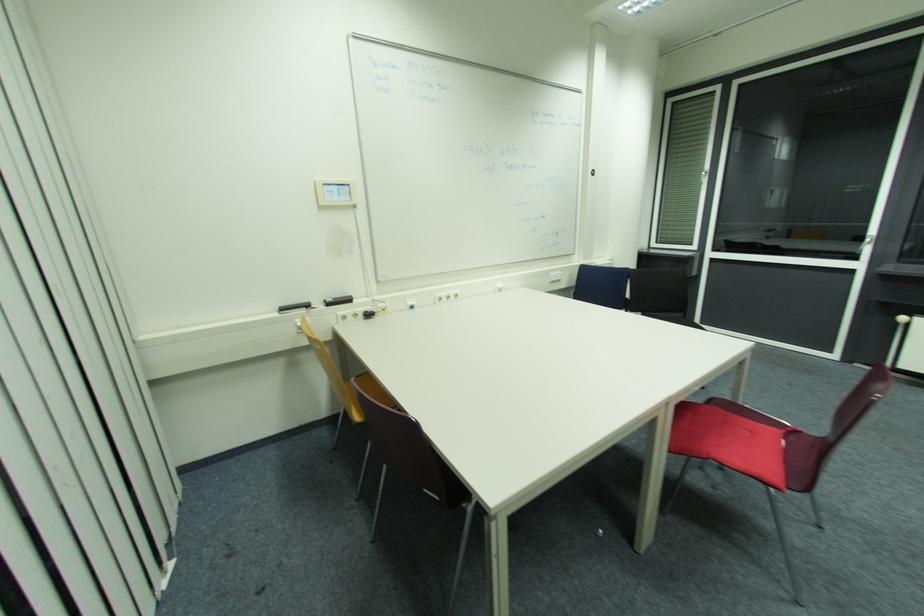
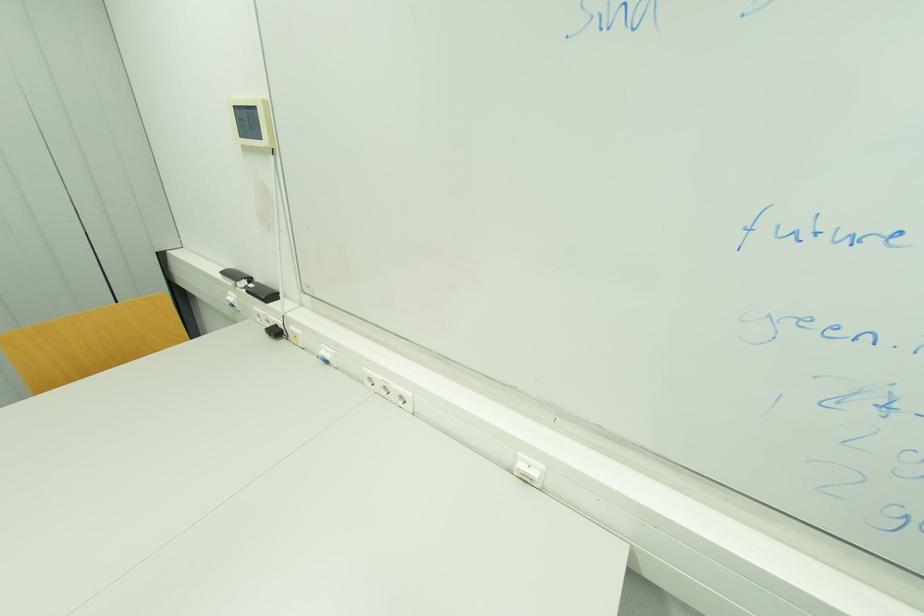
Question: I am providing you with two images of the same scene from different viewpoints. Please identify which objects are invisible in image2.

Choices:
 (A) white power socket
 (B) black switch
 (C) wall-mounted control panel
 (D) none of these

Answer: (D)